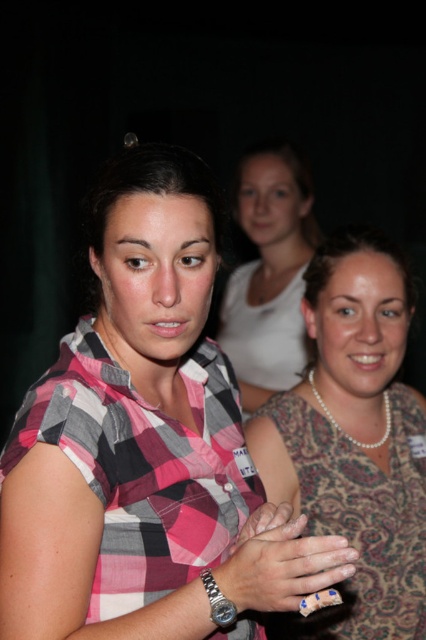
You are standing at the origin point in the image and want to move towards the two points labeled as point (336, 292) and point (258, 516). Which point will you encounter first on your path?

Since point (336, 292) is behind point (258, 516), you will encounter point (258, 516) first on your path.

You are a fashion designer trying to adjust the length of a dress. You have a dress labeled as the patterned fabric dress at center and a hand labeled as the smooth skin hand at center. The hand is part of a model wearing the dress. Can the hand reach the hem of the dress without stretching?

The distance between the patterned fabric dress at center and the smooth skin hand at center is 22.33 inches. Since the hand is 22.33 inches away from the dress hem, the hand cannot reach the hem without stretching as the distance is too large.